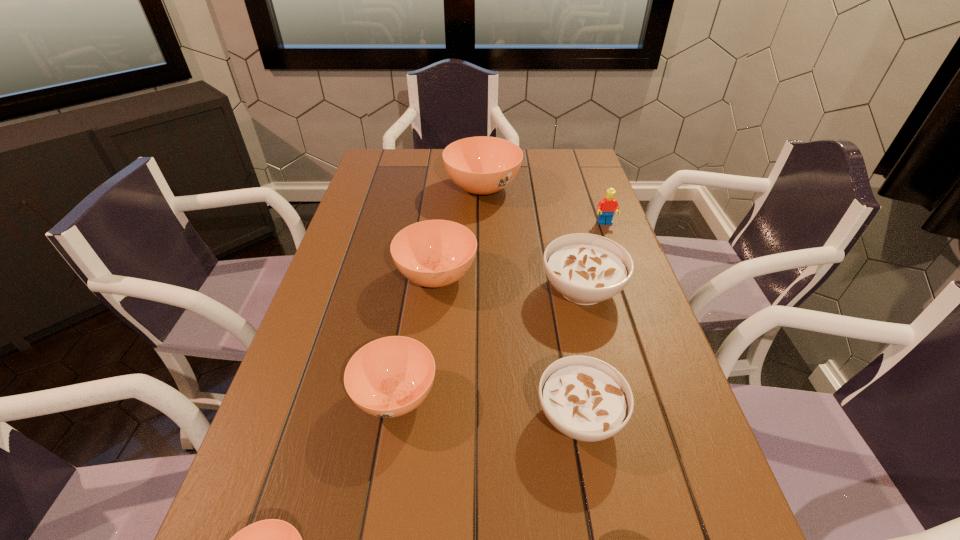
Image resolution: width=960 pixels, height=540 pixels. Identify the location of vacant area located 0.190m on the left of the third nearest peach soup bowl. (323, 276).

This screenshot has width=960, height=540. Identify the location of free spot located 0.290m on the front of the bigger white soup bowl. (619, 438).

Identify the location of vacant space situated 0.180m on the right of the second nearest peach soup bowl. (529, 396).

Where is `vacant space located 0.340m on the left of the nearer white soup bowl`? The height and width of the screenshot is (540, 960). vacant space located 0.340m on the left of the nearer white soup bowl is located at coordinates (357, 416).

This screenshot has height=540, width=960. Find the location of `object that is positioned at the far edge`. object that is positioned at the far edge is located at coordinates (482, 165).

Where is `object that is at the left edge`? object that is at the left edge is located at coordinates (389, 377).

This screenshot has height=540, width=960. I want to click on Lego that is positioned at the right edge, so click(x=607, y=206).

In the image, there is a desktop. Where is `vacant space at the far edge`? This screenshot has width=960, height=540. vacant space at the far edge is located at coordinates (432, 154).

At what (x,y) coordinates should I click in order to perform the action: click on free space at the left edge of the desktop. Please return your answer as a coordinate pair (x, y). Image resolution: width=960 pixels, height=540 pixels. Looking at the image, I should click on (343, 265).

Image resolution: width=960 pixels, height=540 pixels. In order to click on vacant space at the right edge in this screenshot , I will do `click(705, 537)`.